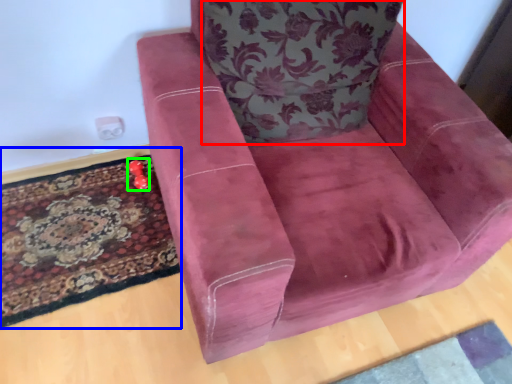
Question: Estimate the real-world distances between objects in this image. Which object is farther from throw pillow (highlighted by a red box), mat (highlighted by a blue box) or toy (highlighted by a green box)?

Choices:
 (A) mat
 (B) toy

Answer: (B)